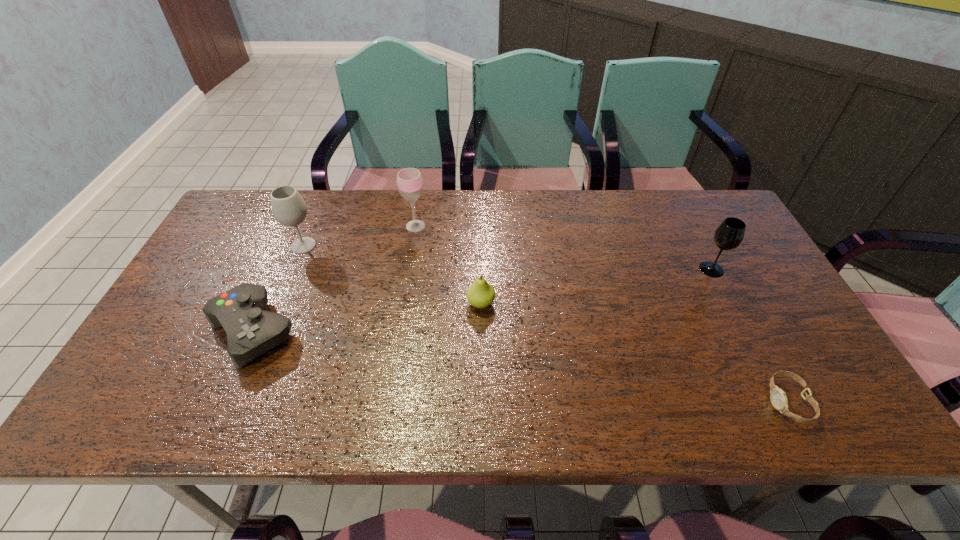
Where is `object located in the left edge section of the desktop`? Image resolution: width=960 pixels, height=540 pixels. object located in the left edge section of the desktop is located at coordinates (251, 331).

Locate an element on the screen. wineglass located in the right edge section of the desktop is located at coordinates click(x=729, y=235).

Where is `watch that is at the right edge`? watch that is at the right edge is located at coordinates (778, 397).

Identify the location of object present at the near right corner. point(778,397).

At what (x,y) coordinates should I click in order to perform the action: click on vacant space at the far edge of the desktop. Please return your answer as a coordinate pair (x, y). The width and height of the screenshot is (960, 540). Looking at the image, I should click on (436, 210).

This screenshot has height=540, width=960. In the image, there is a desktop. What are the coordinates of `vacant space at the near edge` in the screenshot? It's located at (547, 408).

Locate an element on the screen. The width and height of the screenshot is (960, 540). free location at the right edge is located at coordinates (768, 384).

Where is `vacant space at the far left corner of the desktop`? vacant space at the far left corner of the desktop is located at coordinates (237, 230).

Find the location of a particular element. Image resolution: width=960 pixels, height=540 pixels. vacant space at the near left corner of the desktop is located at coordinates (182, 410).

Identify the location of free point between the fifth tallest object and the nearest object. (519, 366).